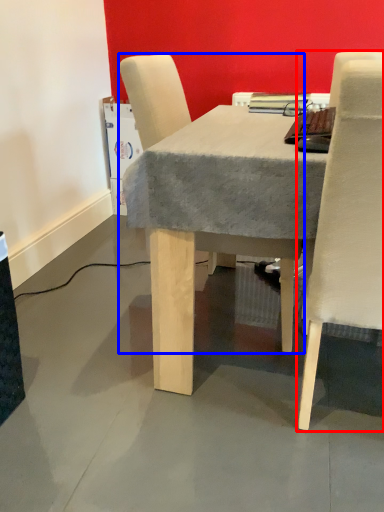
Question: Which object appears farthest to the camera in this image, chair (highlighted by a red box) or chair (highlighted by a blue box)?

Choices:
 (A) chair
 (B) chair

Answer: (B)